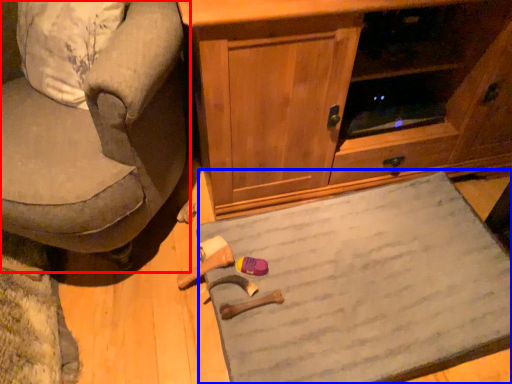
Question: Which of the following is the farthest to the observer, chair (highlighted by a red box) or doormat (highlighted by a blue box)?

Choices:
 (A) chair
 (B) doormat

Answer: (B)